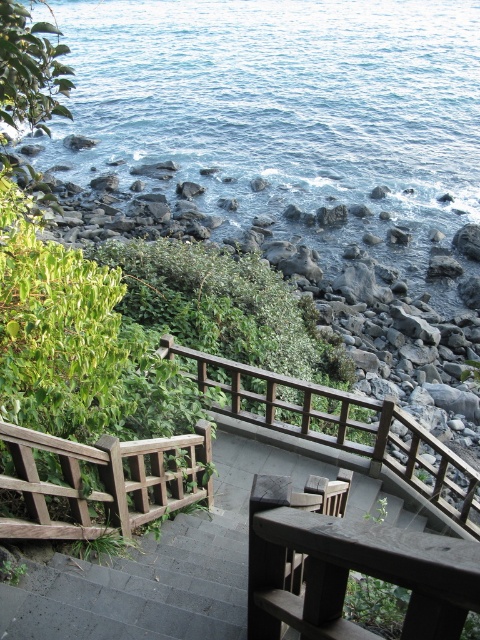
Is blue water at upper left to the right of weathered wood balustrade at lower left from the viewer's perspective?

Indeed, blue water at upper left is positioned on the right side of weathered wood balustrade at lower left.

Find the location of a particular element. blue water at upper left is located at coordinates (280, 99).

Is point (61, 38) more distant than point (28, 476)?

Yes, point (61, 38) is behind point (28, 476).

Find the location of a particular element. The height and width of the screenshot is (640, 480). blue water at upper left is located at coordinates (280, 99).

Does brown wooden balustrade at center have a larger size compared to weathered wood balustrade at lower left?

Indeed, brown wooden balustrade at center has a larger size compared to weathered wood balustrade at lower left.

Can you confirm if brown wooden balustrade at center is taller than weathered wood balustrade at lower left?

Yes, brown wooden balustrade at center is taller than weathered wood balustrade at lower left.

Is point (470, 509) closer to camera compared to point (147, 456)?

No, it is not.

Locate an element on the screen. brown wooden balustrade at center is located at coordinates coord(340,428).

Is blue water at upper left closer to camera compared to brown wooden balustrade at center?

No, blue water at upper left is behind brown wooden balustrade at center.

Where is `blue water at upper left`? Image resolution: width=480 pixels, height=640 pixels. blue water at upper left is located at coordinates (280, 99).

This screenshot has width=480, height=640. I want to click on blue water at upper left, so click(280, 99).

Locate an element on the screen. The width and height of the screenshot is (480, 640). blue water at upper left is located at coordinates (280, 99).